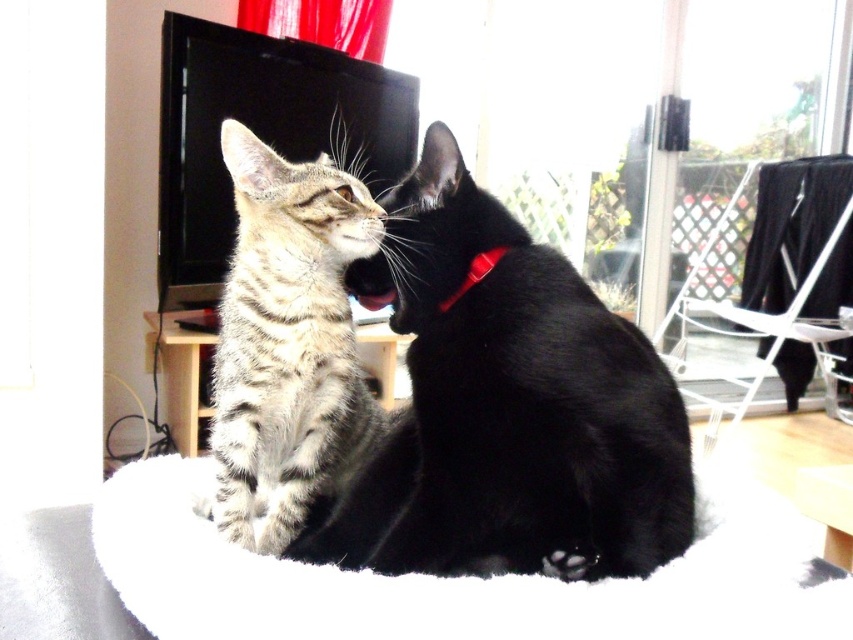
You are a cat owner trying to choose a harness for your cats. The harness is designed to fit cats with a minimum width of 15 cm. You see both the tabby fur cat at center and the striped fur cat at center. Which cat requires a larger harness size based on their width?

The tabby fur cat at center requires a larger harness size because its width surpasses that of the striped fur cat at center.

You are a cat owner who wants to place a new toy between the tabby fur cat at center and the red plastic neckband at center. Where should you place the toy to ensure it is between both objects?

The tabby fur cat at center is positioned on the right side of the red plastic neckband at center. To place the toy between them, position it to the left of the tabby fur cat at center and to the right of the red plastic neckband at center.

You are a photographer trying to capture a closeup of the tabby fur cat at center and the striped fur cat at center. Which cat will appear larger in the photo?

The tabby fur cat at center will appear larger in the photo because it is closer to the viewer than the striped fur cat at center.